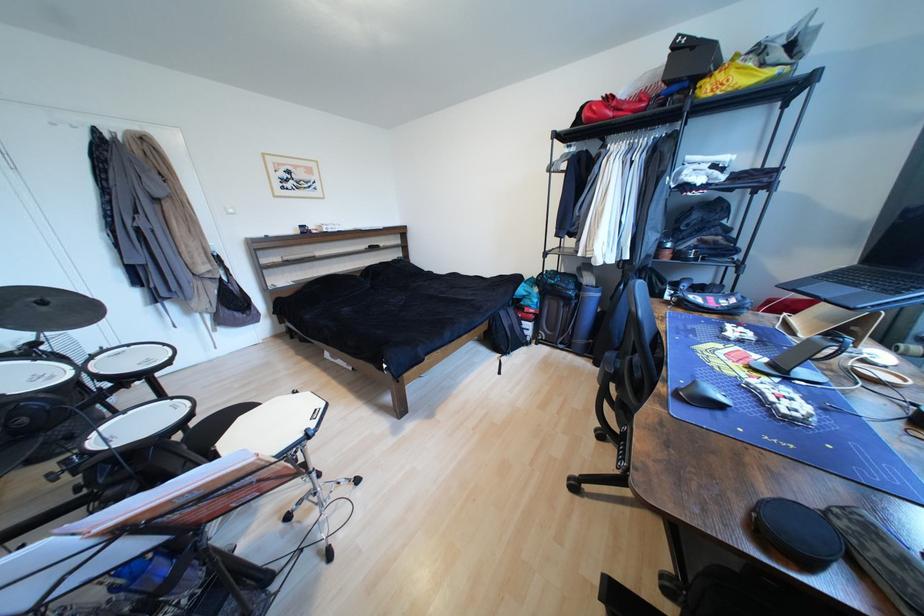
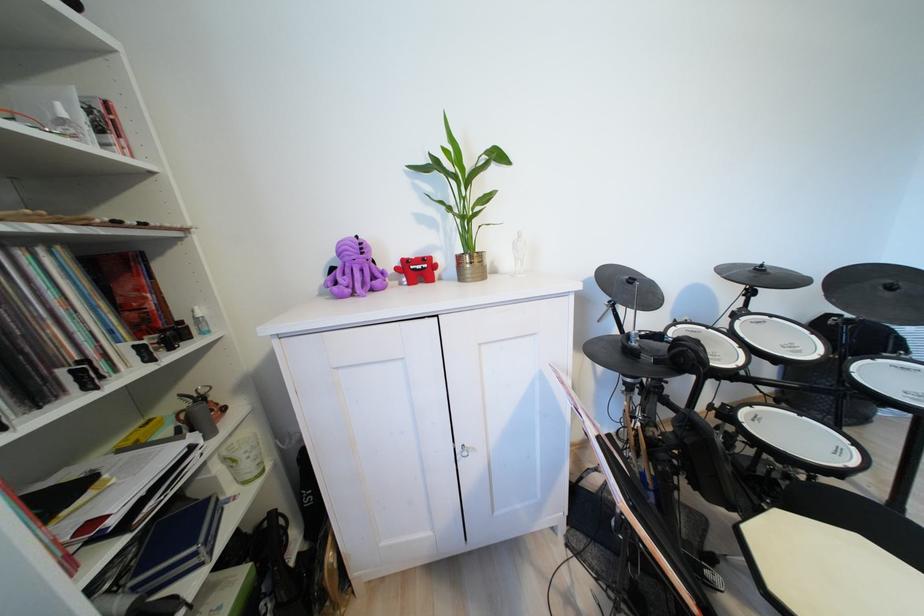
Where in the second image is the point corresponding to [49,305] from the first image?

(897, 289)